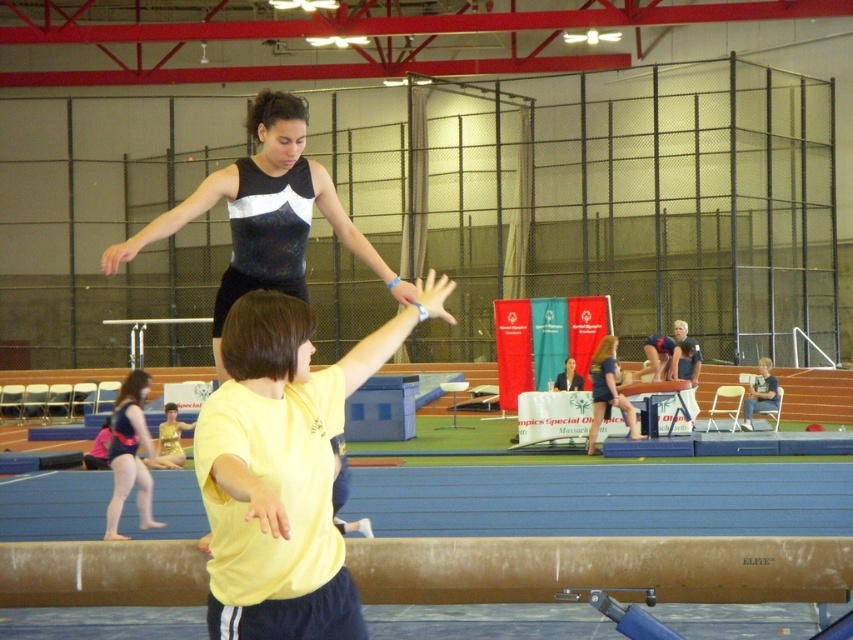
Consider the image. You are a gymnast preparing to perform a routine in this indoor setting. You notice two specific points marked in the scene. Which of these points, point 1 at coordinates (241, 237) or point 2 at (602, 401), is closer to you as you stand at the starting position?

Point 1 at coordinates (241, 237) is closer to you than point 2 at (602, 401).

You are a gymnast preparing to perform on the brown wooden balance beam at center. You notice the matte black leotard at center nearby. Can you safely perform your routine on the beam without the leotard interfering with your movements?

The brown wooden balance beam at center occupies less space than the matte black leotard at center, so the leotard might be too large to allow safe performance on the beam. Adjust your position or choose a smaller leotard to ensure safety.